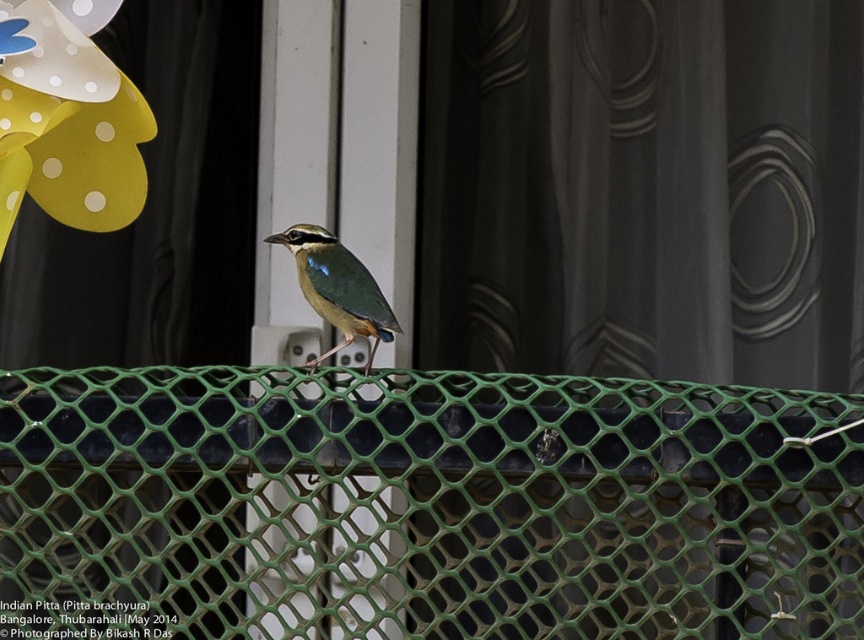
You are a photographer aiming to capture the Indian Pitta bird on the green mesh fence at center without the yellow paper flower at upper left appearing in the background. Based on their positions, is this possible?

The green mesh fence at center is in front of the yellow paper flower at upper left, so if you position yourself so that the fence blocks the flower, you can take the photo without the flower in the background.

You are a small insect trying to climb from the ground to reach the yellow paper flower at upper left. There is a green mesh fence at center blocking your path. Which object is taller and might block your way?

The green mesh fence at center is taller than the yellow paper flower at upper left, so it might block your way.